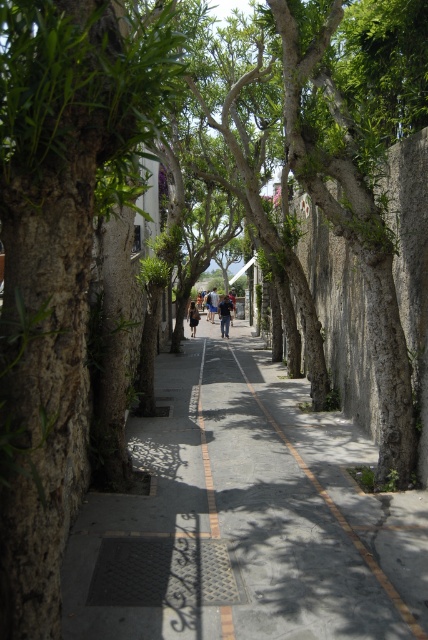
Is point (213, 300) farther from camera compared to point (190, 310)?

Yes.

Does light brown leather jacket at center have a greater height compared to dark blue denim jeans at center?

Yes, light brown leather jacket at center is taller than dark blue denim jeans at center.

Does point (213, 314) come closer to viewer compared to point (196, 317)?

No, (213, 314) is further to viewer.

This screenshot has height=640, width=428. Find the location of `light brown leather jacket at center`. light brown leather jacket at center is located at coordinates point(211,304).

Between point (97, 605) and point (226, 333), which one is positioned in front?

Point (97, 605)

Does smooth concrete pavement at center appear on the left side of dark blue denim jacket at center?

Incorrect, smooth concrete pavement at center is not on the left side of dark blue denim jacket at center.

Find the location of `smooth concrete pavement at center`. smooth concrete pavement at center is located at coordinates (244, 516).

This screenshot has width=428, height=640. Describe the element at coordinates (225, 316) in the screenshot. I see `dark blue denim jacket at center` at that location.

Locate an element on the screen. The image size is (428, 640). dark blue denim jacket at center is located at coordinates (225, 316).

Is point (220, 310) positioned before point (214, 307)?

That is True.

Identify the location of dark blue denim jacket at center. (225, 316).